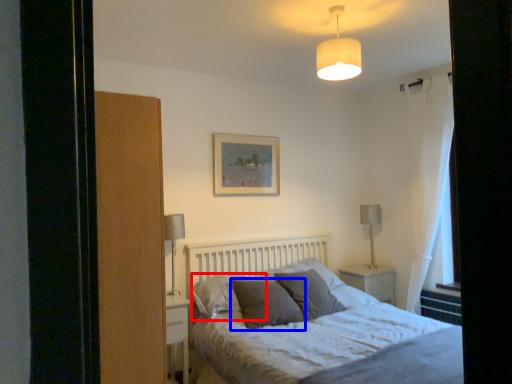
Question: Which of the following is the farthest to the observer, pillow (highlighted by a red box) or pillow (highlighted by a blue box)?

Choices:
 (A) pillow
 (B) pillow

Answer: (A)